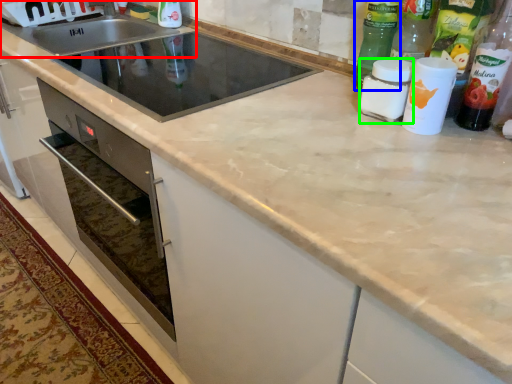
Question: Considering the real-world distances, which object is closest to sink (highlighted by a red box)? bottle (highlighted by a blue box) or bottle (highlighted by a green box).

Choices:
 (A) bottle
 (B) bottle

Answer: (A)